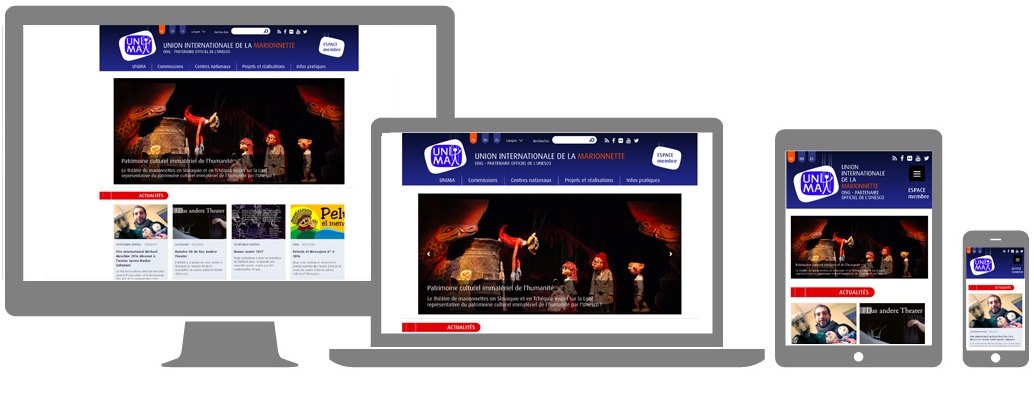
Where is `phone`? The height and width of the screenshot is (403, 1034). phone is located at coordinates (1016, 360).